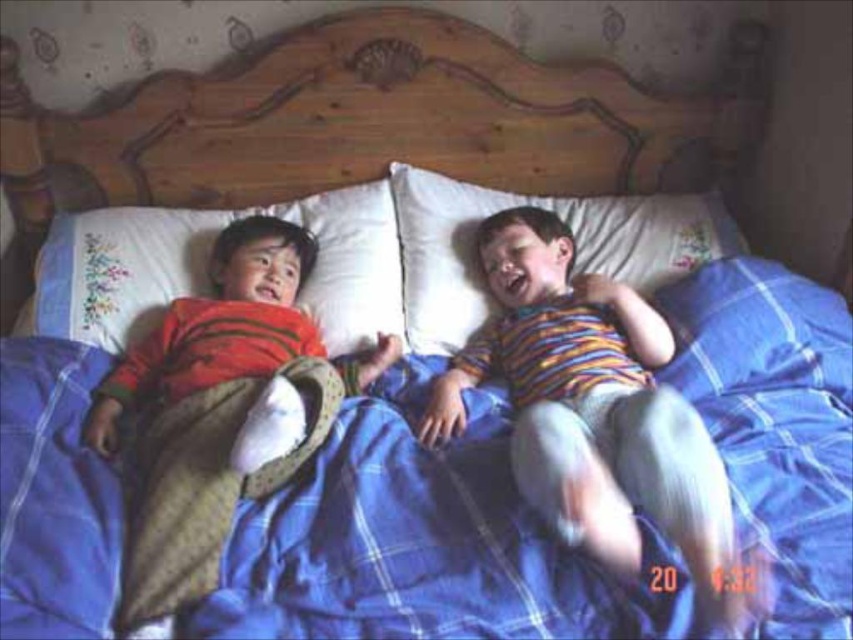
Who is more distant from viewer, (x=276, y=337) or (x=334, y=349)?

Point (x=334, y=349)

Does matte orange shirt at left have a smaller size compared to white embroidered pillow at upper left?

No.

Measure the distance between point (219, 288) and camera.

Point (219, 288) is 5.03 feet away from camera.

You are a GUI agent. You are given a task and a screenshot of the screen. Output one action in this format:
    pyautogui.click(x=<x>, y=<y>)
    Task: Click on the matte orange shirt at left
    This screenshot has height=640, width=853.
    Given the screenshot: What is the action you would take?
    pyautogui.click(x=219, y=408)

Which of these two, matte orange shirt at left or white soft pillow at center, stands shorter?

With less height is white soft pillow at center.

Does matte orange shirt at left have a greater width compared to white soft pillow at center?

No, matte orange shirt at left is not wider than white soft pillow at center.

The width and height of the screenshot is (853, 640). Describe the element at coordinates (219, 408) in the screenshot. I see `matte orange shirt at left` at that location.

Find the location of a particular element. This screenshot has width=853, height=640. matte orange shirt at left is located at coordinates (219, 408).

Looking at this image, does wooden headboard at upper center have a smaller size compared to striped cotton shirt at center?

No.

Is point (715, 140) in front of point (575, 452)?

That is False.

Find the location of a particular element. This screenshot has width=853, height=640. wooden headboard at upper center is located at coordinates (390, 122).